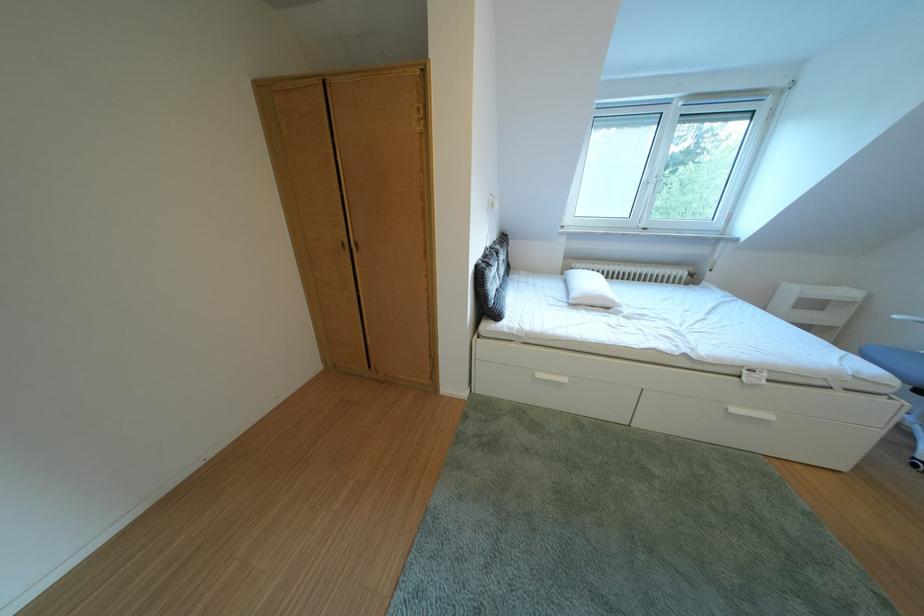
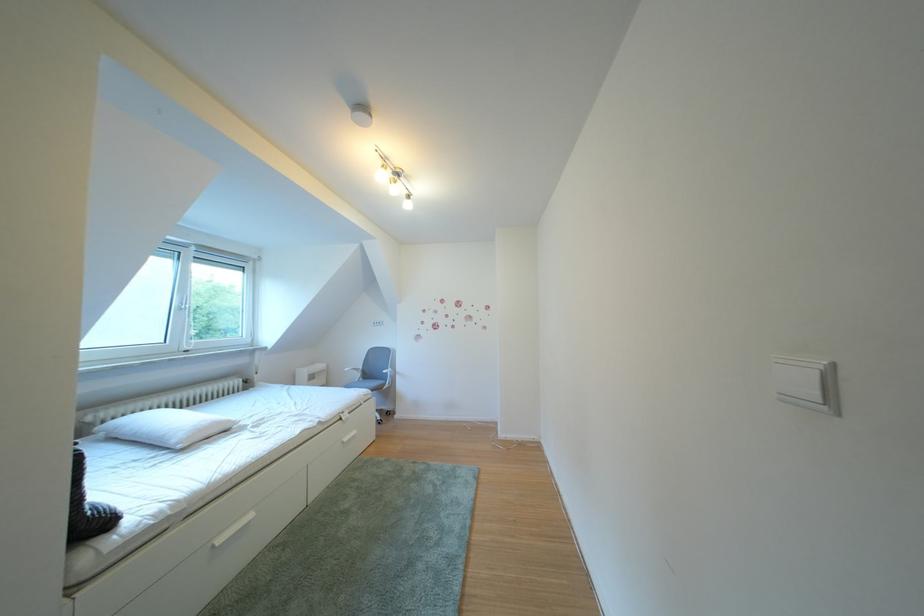
In the second image, find the point that corresponds to point 588,270 in the first image.

(103, 424)